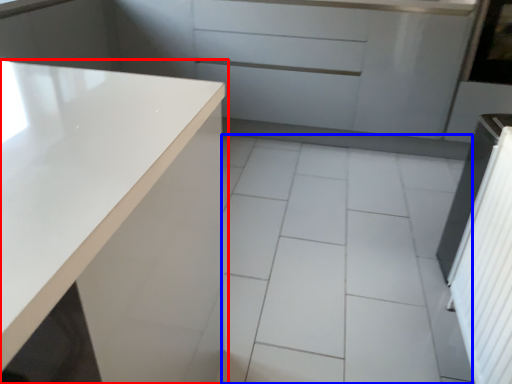
Question: Among these objects, which one is nearest to the camera, countertop (highlighted by a red box) or ceramic tile (highlighted by a blue box)?

Choices:
 (A) countertop
 (B) ceramic tile

Answer: (A)